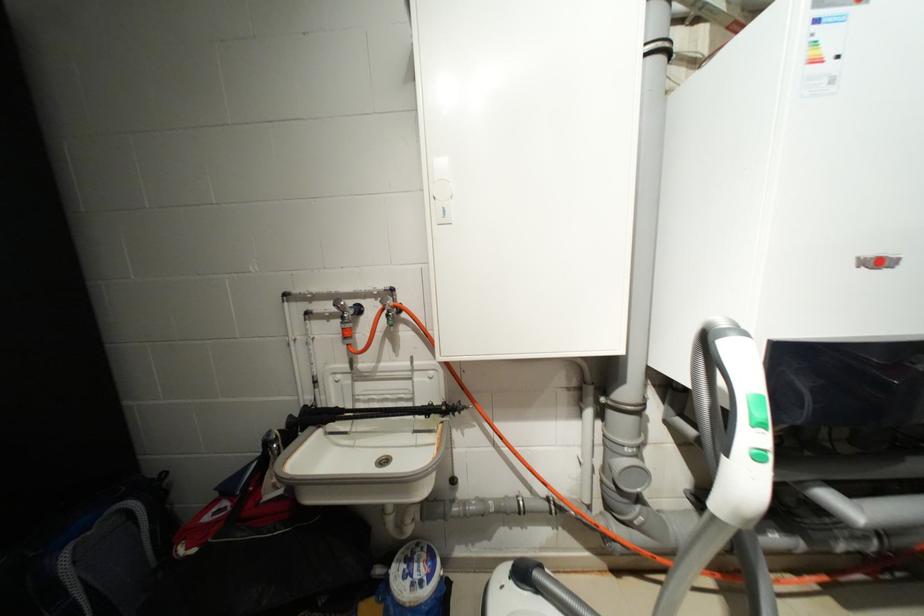
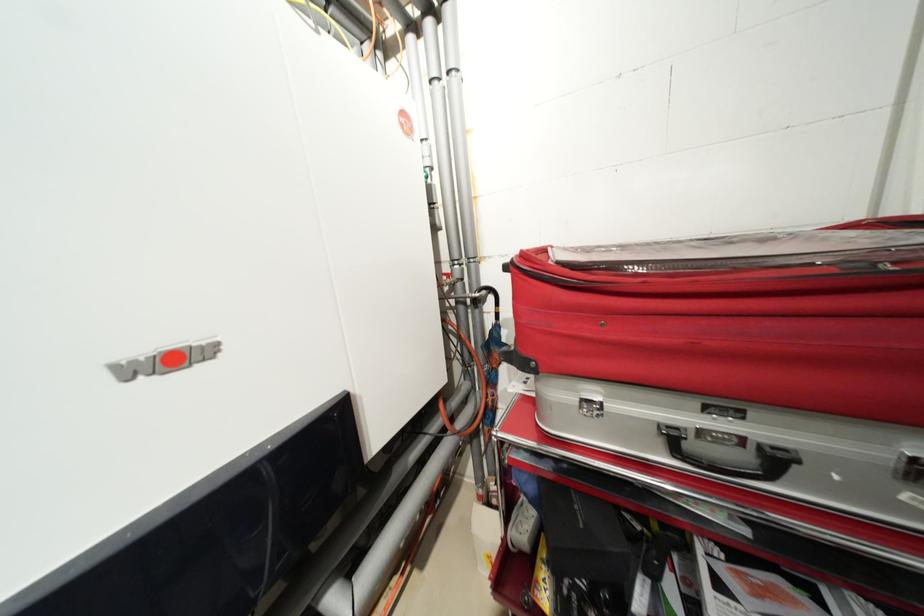
Question: The images are taken continuously from a first-person perspective. In which direction is your viewpoint rotating?

Choices:
 (A) Left
 (B) Right
 (C) Up
 (D) Down

Answer: (B)